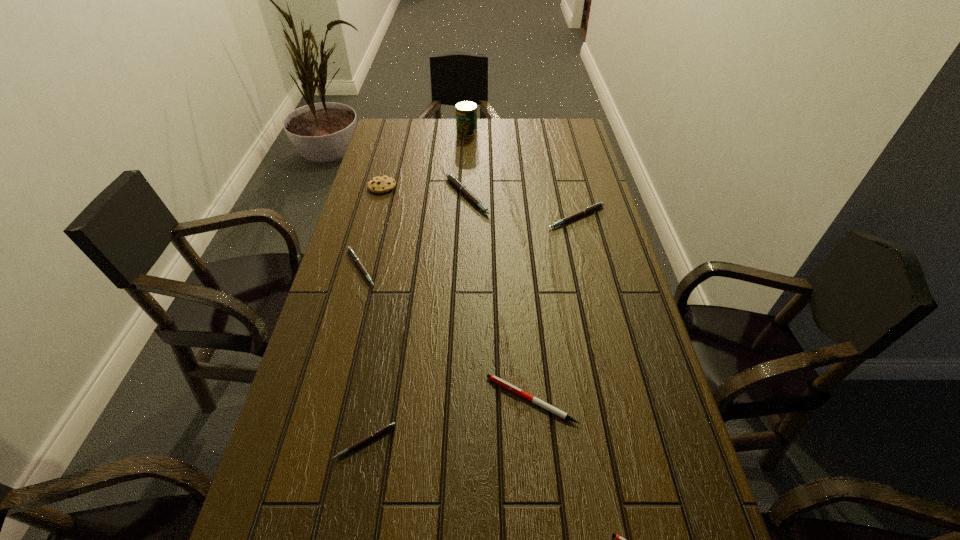
The height and width of the screenshot is (540, 960). Identify the location of the farther white pen. (495, 379).

This screenshot has height=540, width=960. Find the location of `the bigger white pen`. the bigger white pen is located at coordinates (495, 379).

This screenshot has width=960, height=540. In order to click on the smallest pink pen in this screenshot , I will do (386, 428).

At what (x,y) coordinates should I click in order to perform the action: click on free space located 0.060m on the front of the tallest object. Please return your answer as a coordinate pair (x, y). Looking at the image, I should click on (467, 146).

You are a GUI agent. You are given a task and a screenshot of the screen. Output one action in this format:
    pyautogui.click(x=<x>, y=<y>)
    Task: Click on the free point located 0.160m on the back of the brown cookie
    
    Given the screenshot: What is the action you would take?
    pyautogui.click(x=391, y=155)

The image size is (960, 540). I want to click on free location located 0.190m at the nib of the third pink pen from left to right, so click(x=547, y=197).

This screenshot has height=540, width=960. Identify the location of free region located at the nib of the fifth shortest object. (599, 310).

Where is `free space located at the nib of the fourth nearest pen`? This screenshot has height=540, width=960. free space located at the nib of the fourth nearest pen is located at coordinates (468, 268).

Where is `vacant space located on the clicker of the farther white pen`? The image size is (960, 540). vacant space located on the clicker of the farther white pen is located at coordinates (404, 400).

The height and width of the screenshot is (540, 960). Identify the location of free spot located 0.340m on the clicker of the farther white pen. (x=331, y=400).